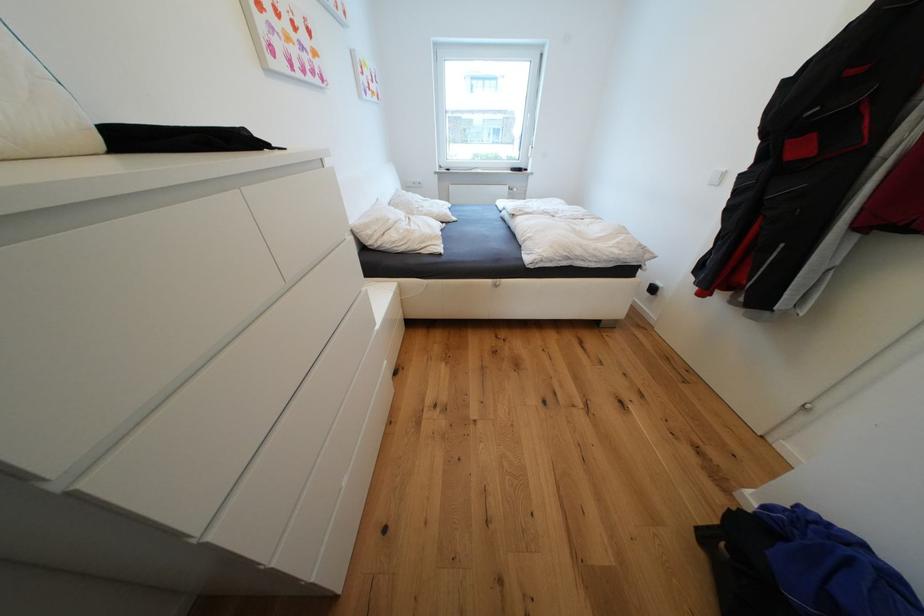
Describe the element at coordinates (512, 191) in the screenshot. The image size is (924, 616). I see `a white radiator valve` at that location.